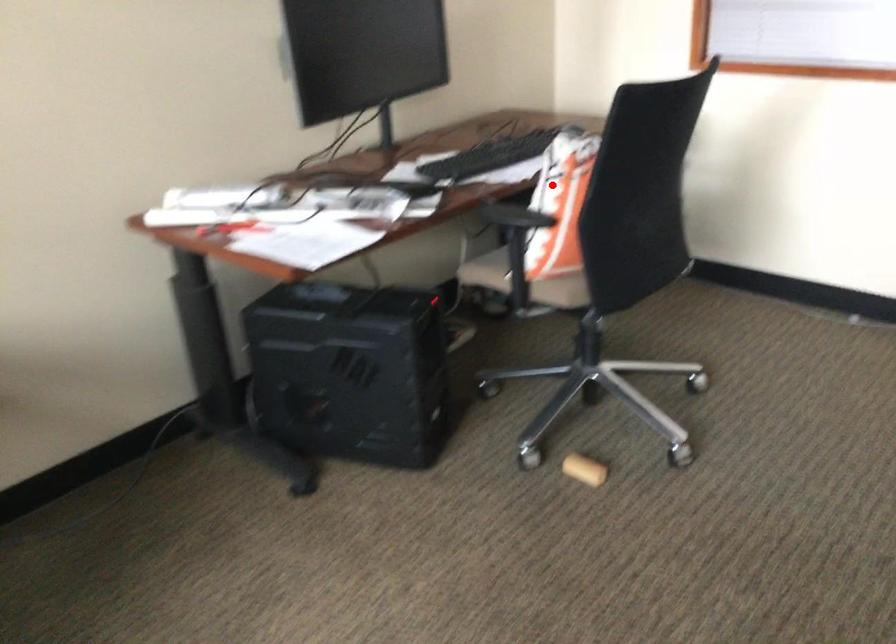
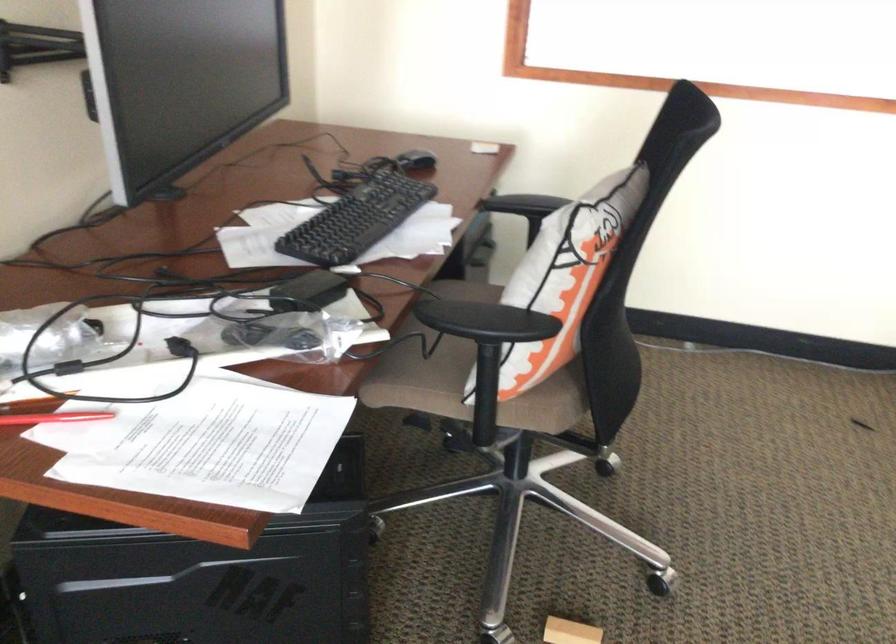
Locate, in the second image, the point that corresponds to the highlighted location in the first image.

(564, 277)